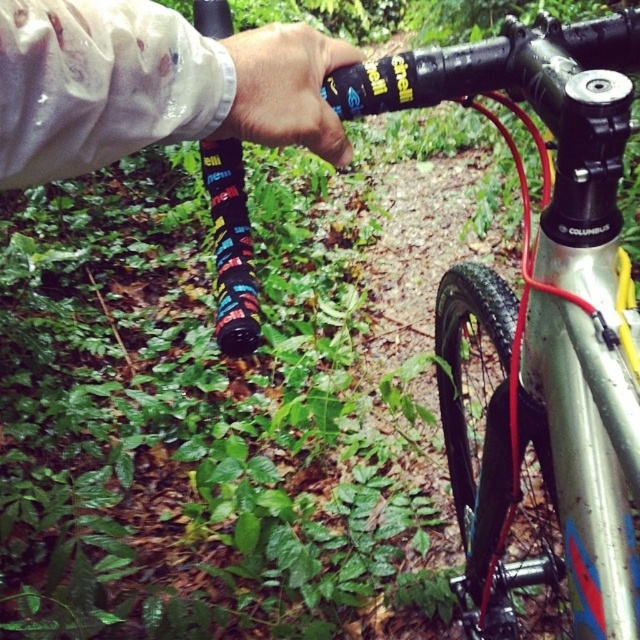
Question: Can you confirm if silver metallic frame at center is smaller than white waterproof glove at upper left?

Choices:
 (A) yes
 (B) no

Answer: (B)

Question: Which point is closer to the camera?

Choices:
 (A) (296, 106)
 (B) (572, 608)

Answer: (A)

Question: Which of the following is the closest to the observer?

Choices:
 (A) white waterproof glove at upper left
 (B) matte black grip at center
 (C) silver metallic frame at center

Answer: (A)

Question: Is silver metallic frame at center bigger than matte black grip at center?

Choices:
 (A) yes
 (B) no

Answer: (A)

Question: Among these points, which one is nearest to the camera?

Choices:
 (A) (528, 614)
 (B) (228, 134)
 (C) (268, 118)

Answer: (C)

Question: Considering the relative positions of silver metallic frame at center and matte black grip at center in the image provided, where is silver metallic frame at center located with respect to matte black grip at center?

Choices:
 (A) below
 (B) above

Answer: (A)